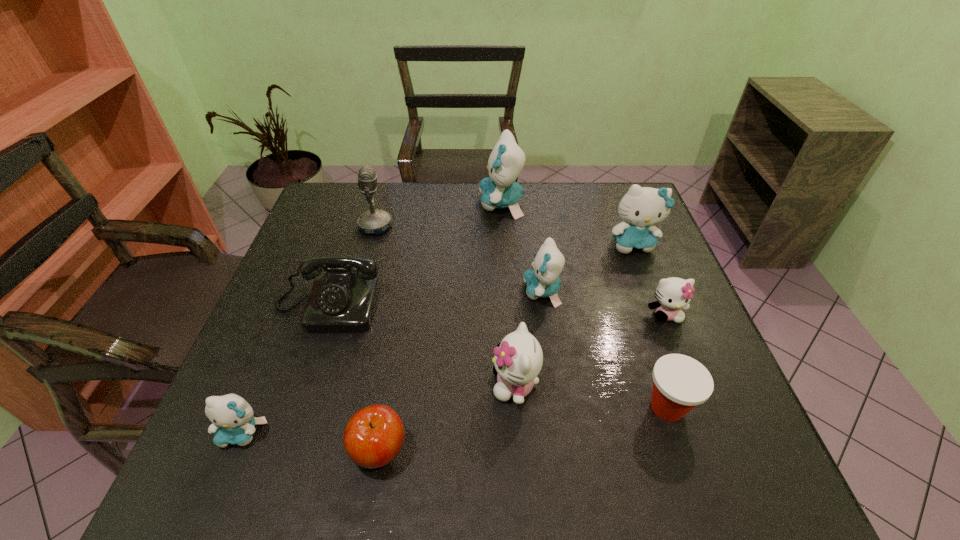
Identify the location of blank area at the far edge. Image resolution: width=960 pixels, height=540 pixels. (414, 186).

At what (x,y) coordinates should I click in order to perform the action: click on vacant space at the near edge of the desktop. Please return your answer as a coordinate pair (x, y). The height and width of the screenshot is (540, 960). Looking at the image, I should click on (684, 494).

At what (x,y) coordinates should I click in order to perform the action: click on vacant area at the left edge. Please return your answer as a coordinate pair (x, y). Looking at the image, I should click on (252, 396).

You are a GUI agent. You are given a task and a screenshot of the screen. Output one action in this format:
    pyautogui.click(x=<x>, y=<y>)
    Task: Click on the vacant space at the far left corner of the desktop
    The image size is (960, 540).
    Given the screenshot: What is the action you would take?
    pyautogui.click(x=364, y=210)

This screenshot has width=960, height=540. I want to click on free spot at the near left corner of the desktop, so click(x=226, y=466).

In the image, there is a desktop. At what (x,y) coordinates should I click in order to perform the action: click on free space at the far right corner. Please return your answer as a coordinate pair (x, y). This screenshot has height=540, width=960. Looking at the image, I should click on (611, 210).

Locate an element on the screen. empty space between the bigger white kitten and the rightmost blue kitten is located at coordinates (574, 314).

The width and height of the screenshot is (960, 540). Find the location of `vacant space in between the biggest blue kitten and the second nearest kitten`. vacant space in between the biggest blue kitten and the second nearest kitten is located at coordinates (508, 294).

Locate an element on the screen. empty location between the nearest blue kitten and the third biggest blue kitten is located at coordinates (392, 362).

The width and height of the screenshot is (960, 540). What are the coordinates of `free space between the leftmost kitten and the second smallest blue kitten` in the screenshot? It's located at (392, 362).